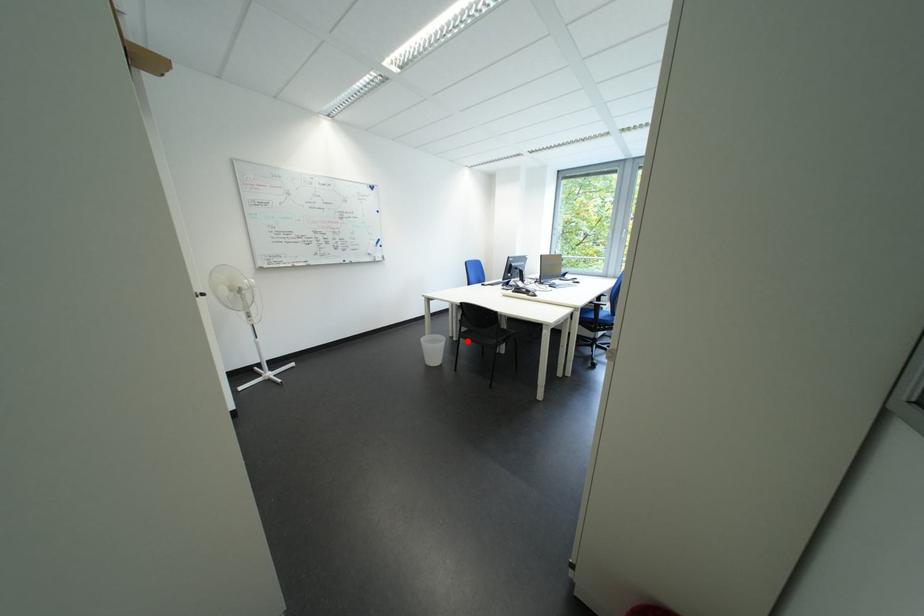
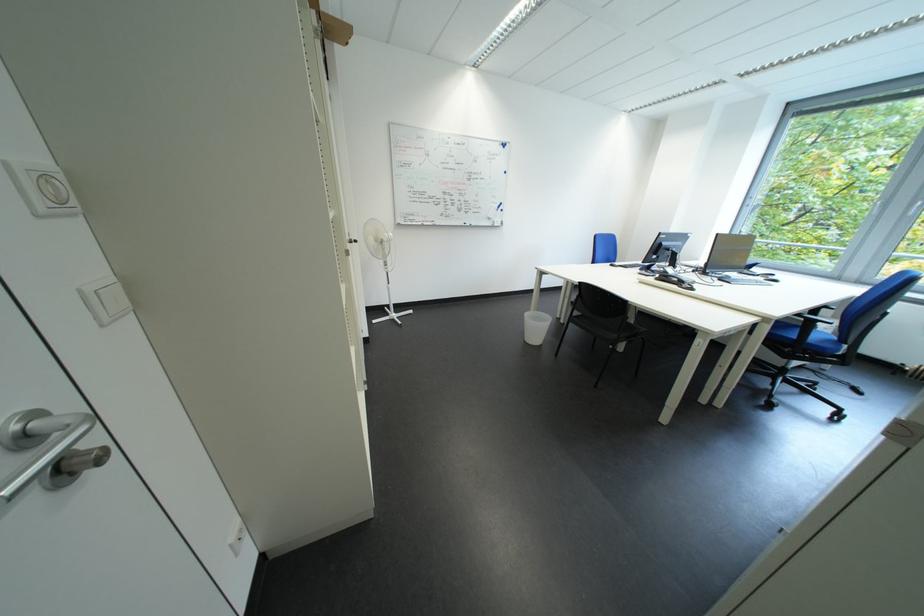
Question: I am providing you with two images of the same scene from different viewpoints. Image1 has a red point marked. In image2, the corresponding 3D location appears at what relative position? Reply with the corresponding letter.

Choices:
 (A) Closer
 (B) Farther

Answer: (A)